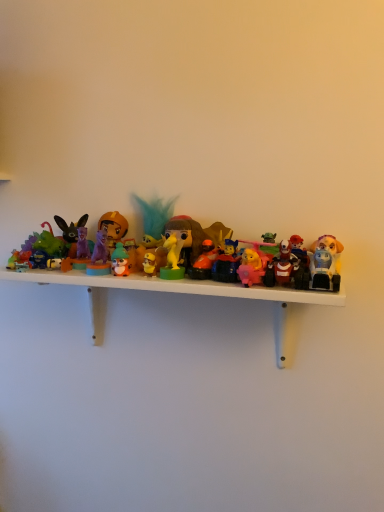
Question: From the image's perspective, is plush yellow dog at right, marked as the thirteenth toy in a left-to-right arrangement, on pink plastic bear at center, which is counted as the 3th toy, starting from the right?

Choices:
 (A) no
 (B) yes

Answer: (B)

Question: Considering the relative sizes of plush yellow dog at right, positioned as the 1th toy in right-to-left order, and pink plastic bear at center, arranged as the 11th toy when viewed from the left, in the image provided, is plush yellow dog at right, positioned as the 1th toy in right-to-left order, bigger than pink plastic bear at center, arranged as the 11th toy when viewed from the left,?

Choices:
 (A) yes
 (B) no

Answer: (A)

Question: Is plush yellow dog at right, marked as the thirteenth toy in a left-to-right arrangement, in contact with pink plastic bear at center, which is counted as the 3th toy, starting from the right?

Choices:
 (A) yes
 (B) no

Answer: (A)

Question: Is plush yellow dog at right, marked as the thirteenth toy in a left-to-right arrangement, taller than pink plastic bear at center, arranged as the 11th toy when viewed from the left?

Choices:
 (A) no
 (B) yes

Answer: (A)

Question: Is plush yellow dog at right, positioned as the 1th toy in right-to-left order, thinner than pink plastic bear at center, which is counted as the 3th toy, starting from the right?

Choices:
 (A) no
 (B) yes

Answer: (B)

Question: Is matte orange helmet at center, acting as the 10th toy starting from the right, situated inside shiny plastic figure at center, placed as the tenth toy when sorted from left to right, or outside?

Choices:
 (A) outside
 (B) inside

Answer: (A)

Question: In terms of width, does matte orange helmet at center, acting as the 10th toy starting from the right, look wider or thinner when compared to shiny plastic figure at center, which ranks as the fourth toy in right-to-left order?

Choices:
 (A) wide
 (B) thin

Answer: (B)

Question: Considering the positions of point (119, 236) and point (226, 249), is point (119, 236) closer or farther from the camera than point (226, 249)?

Choices:
 (A) closer
 (B) farther

Answer: (B)

Question: Is matte orange helmet at center, the fourth toy in the left-to-right sequence, bigger or smaller than shiny plastic figure at center, which ranks as the fourth toy in right-to-left order?

Choices:
 (A) big
 (B) small

Answer: (A)

Question: From the image's perspective, relative to matte plastic figure at center-right, the 2th toy when ordered from right to left, is teal feather at center, arranged as the 6th toy when viewed from the left, above or below?

Choices:
 (A) below
 (B) above

Answer: (B)

Question: From their relative heights in the image, would you say teal feather at center, arranged as the 6th toy when viewed from the left, is taller or shorter than matte plastic figure at center-right, the 2th toy when ordered from right to left?

Choices:
 (A) short
 (B) tall

Answer: (B)

Question: From a real-world perspective, is teal feather at center, arranged as the 6th toy when viewed from the left, above or below matte plastic figure at center-right, which ranks as the twelfth toy in left-to-right order?

Choices:
 (A) above
 (B) below

Answer: (A)

Question: Is teal feather at center, arranged as the 6th toy when viewed from the left, wider or thinner than matte plastic figure at center-right, the 2th toy when ordered from right to left?

Choices:
 (A) wide
 (B) thin

Answer: (A)

Question: Is matte plastic toy at center, which is the fifth toy from right to left, situated inside matte green plush at center, the ninth toy positioned from the right, or outside?

Choices:
 (A) outside
 (B) inside

Answer: (A)

Question: From a real-world perspective, is matte plastic toy at center, which is the fifth toy from right to left, above or below matte green plush at center, the 5th toy in the left-to-right sequence?

Choices:
 (A) above
 (B) below

Answer: (A)